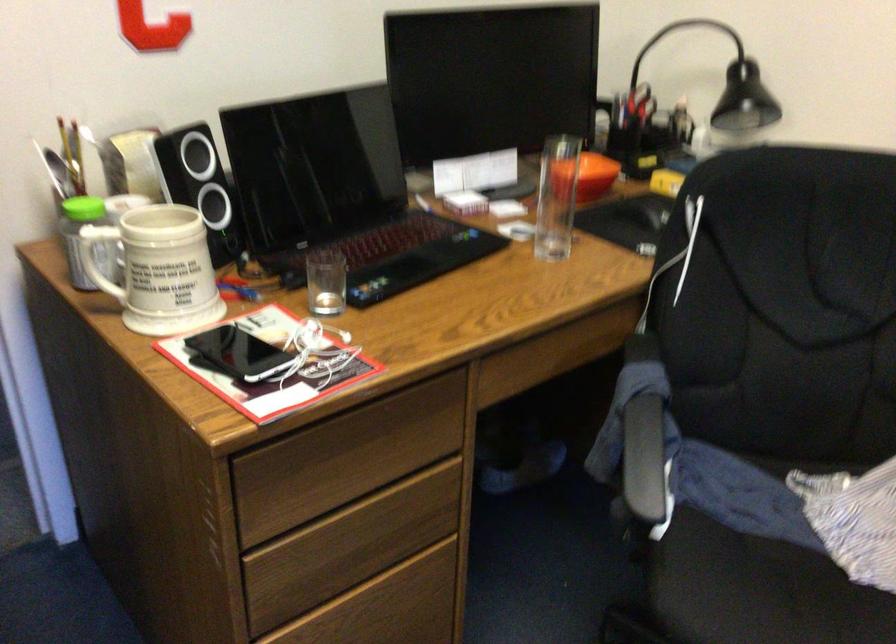
Find the location of a particular element. The width and height of the screenshot is (896, 644). green-lidded container is located at coordinates (88, 242).